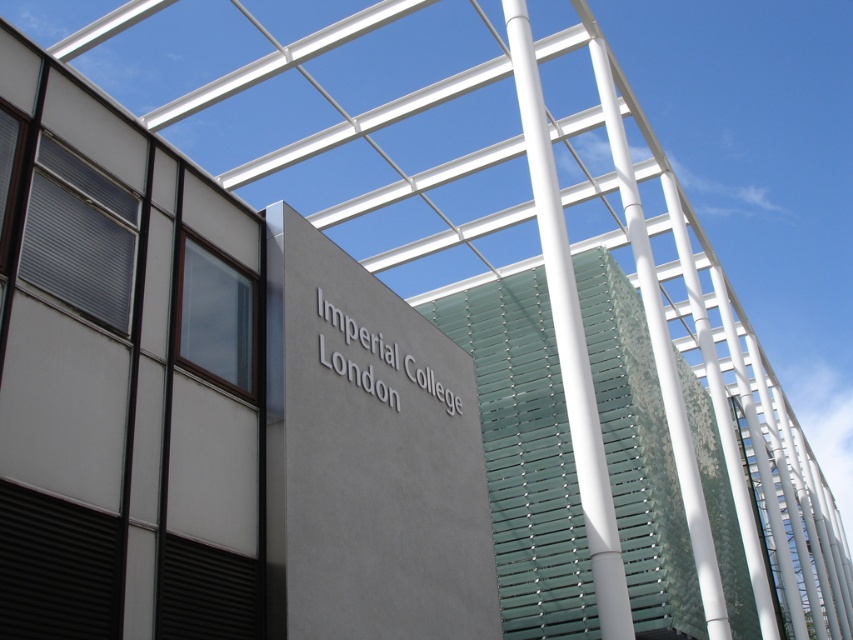
Between black matte shutter at lower left and brown matte shutter at upper left, which one is positioned lower?

black matte shutter at lower left

Which is more to the left, black matte shutter at lower left or brown matte shutter at upper left?

Positioned to the left is black matte shutter at lower left.

Locate an element on the screen. The image size is (853, 640). black matte shutter at lower left is located at coordinates (55, 566).

Between black matte shutter at lower left and matte gray shutter at upper left, which one appears on the right side from the viewer's perspective?

black matte shutter at lower left

How much distance is there between black matte shutter at lower left and matte gray shutter at upper left?

They are 2.54 meters apart.

Image resolution: width=853 pixels, height=640 pixels. Find the location of `black matte shutter at lower left`. black matte shutter at lower left is located at coordinates (55, 566).

This screenshot has height=640, width=853. In order to click on black matte shutter at lower left in this screenshot , I will do `click(55, 566)`.

Does gray concrete sign at center appear on the right side of transparent glass building at center?

In fact, gray concrete sign at center is to the left of transparent glass building at center.

Who is higher up, gray concrete sign at center or transparent glass building at center?

gray concrete sign at center is higher up.

The width and height of the screenshot is (853, 640). What are the coordinates of `gray concrete sign at center` in the screenshot? It's located at (x=367, y=456).